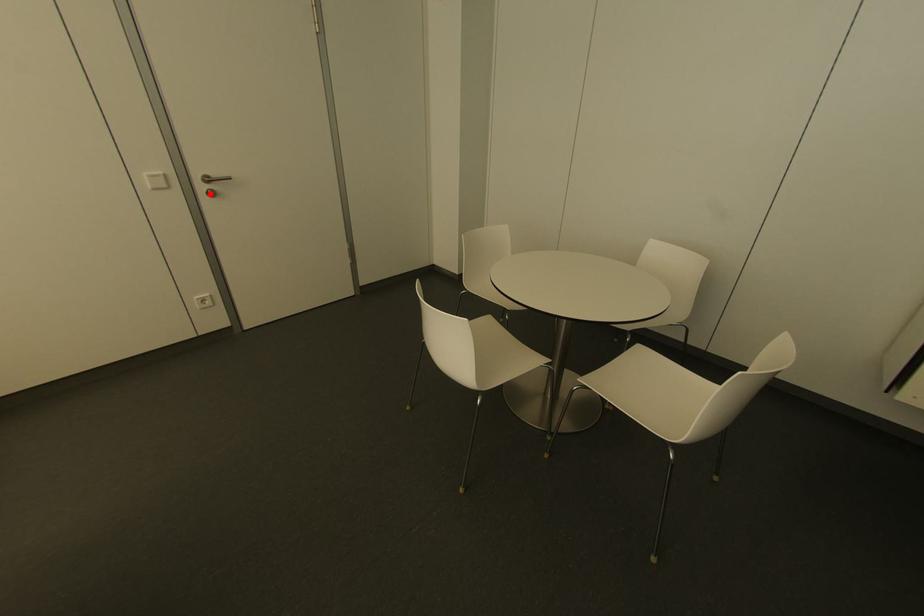
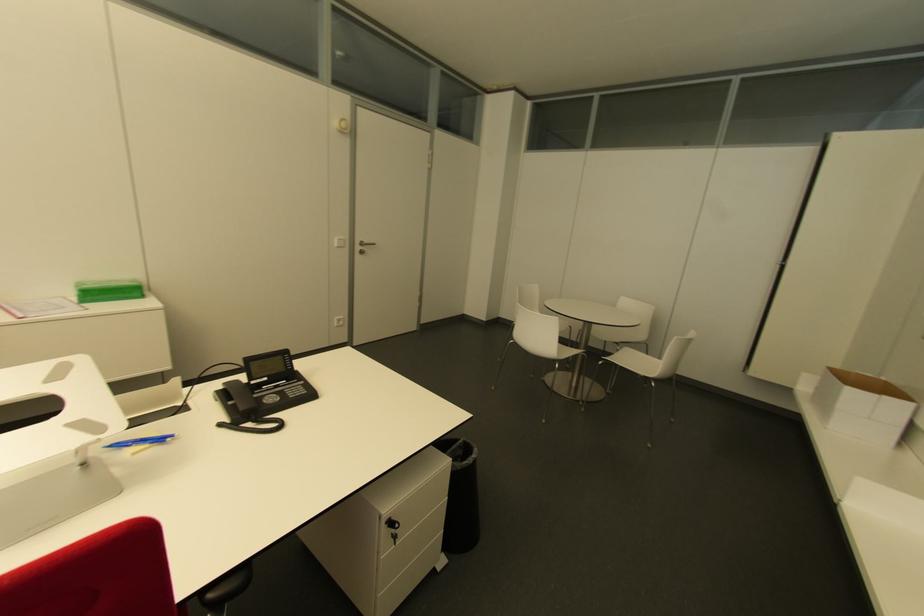
Find the pixel in the second image that matches the highlighted location in the first image.

(360, 253)